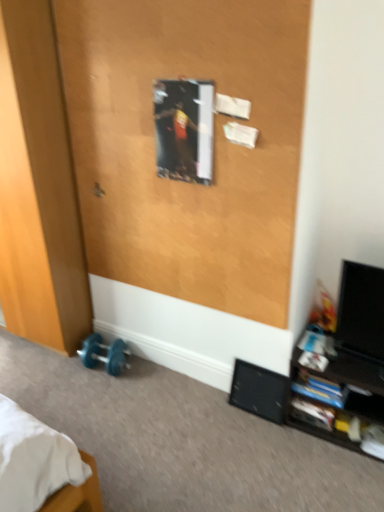
You are a GUI agent. You are given a task and a screenshot of the screen. Output one action in this format:
    pyautogui.click(x=<x>, y=<y>)
    Task: Click on the vacant area on top of blue rubber dumbbell at lower left (from a real-world perspective)
    This screenshot has height=512, width=384.
    Given the screenshot: What is the action you would take?
    pyautogui.click(x=109, y=349)